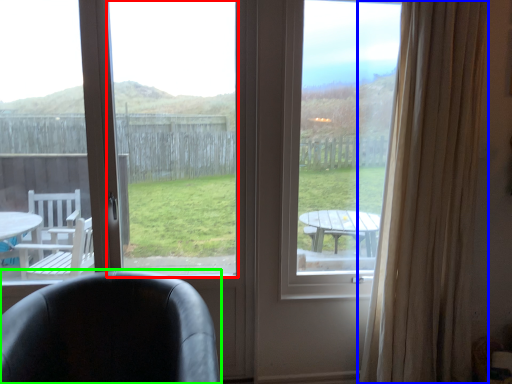
Question: Which object is positioned farthest from window screen (highlighted by a red box)? Select from curtain (highlighted by a blue box) and chair (highlighted by a green box).

Choices:
 (A) curtain
 (B) chair

Answer: (A)